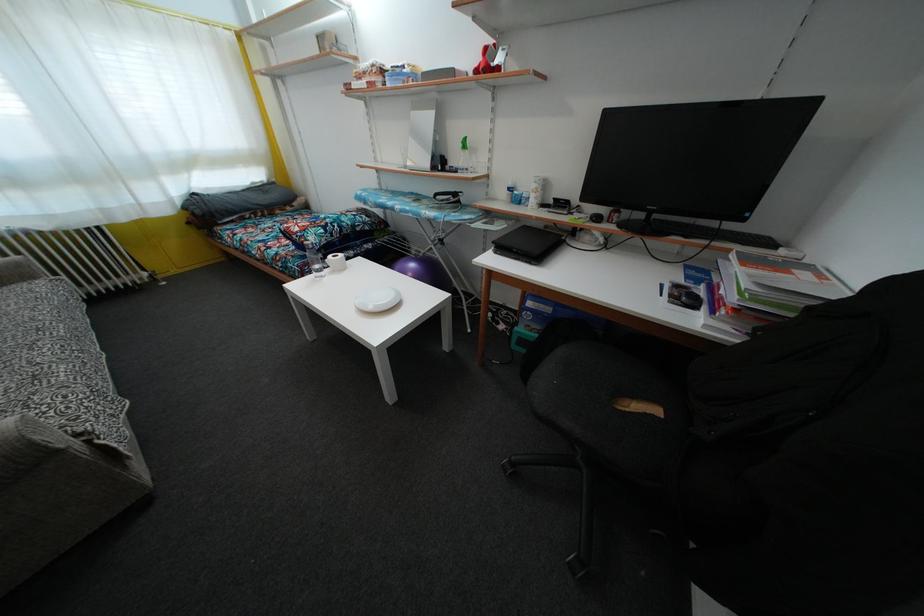
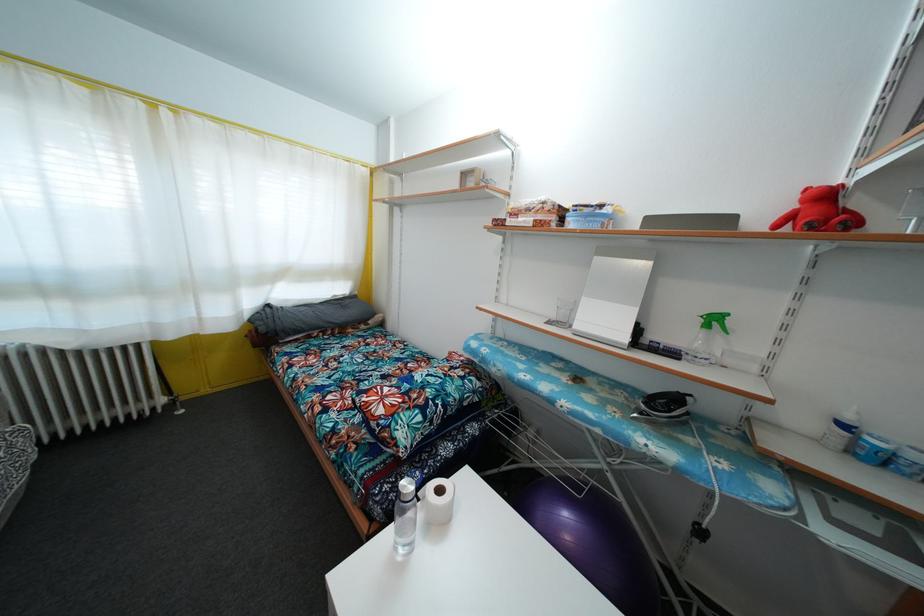
The point at (407, 73) is marked in the first image. Where is the corresponding point in the second image?

(605, 213)